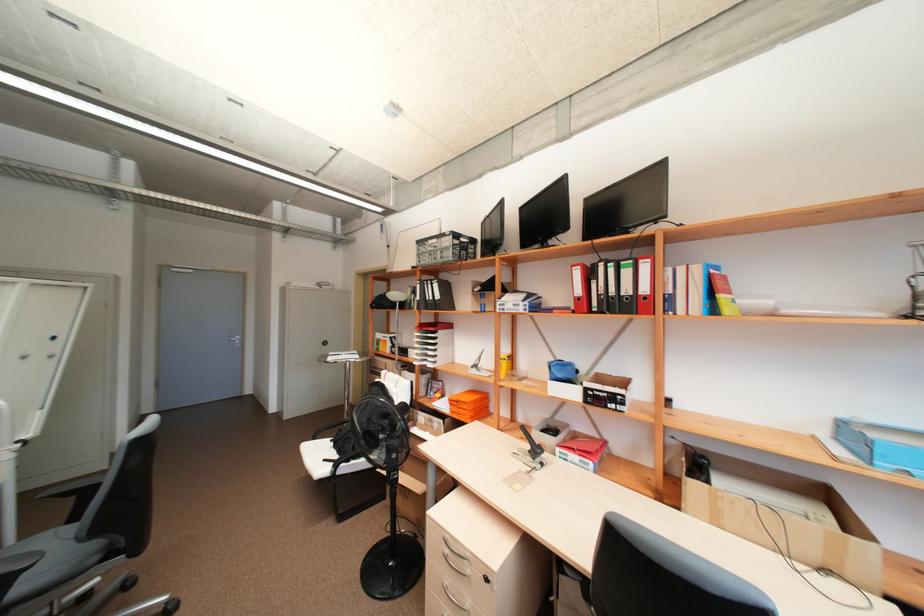
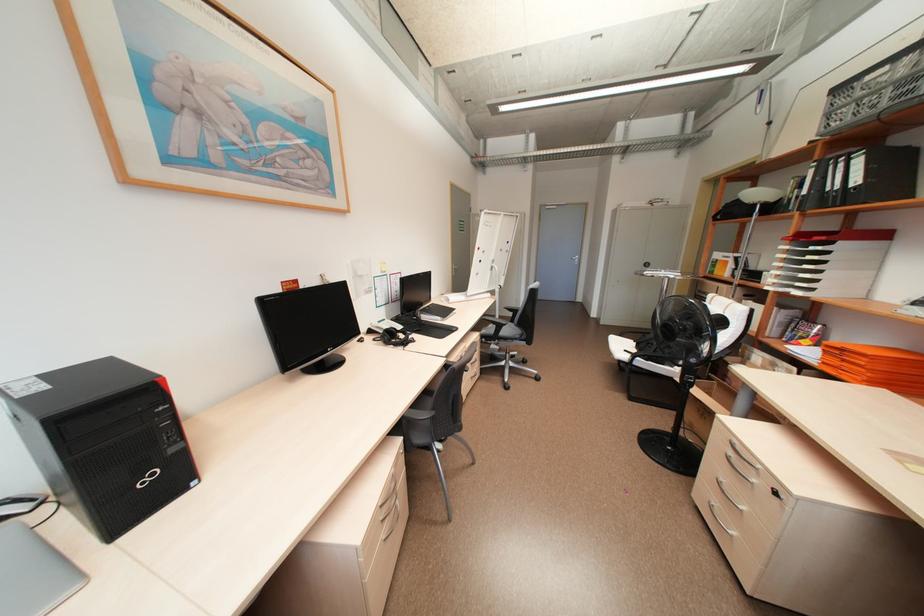
The point at (442,285) is marked in the first image. Where is the corresponding point in the second image?

(865, 161)